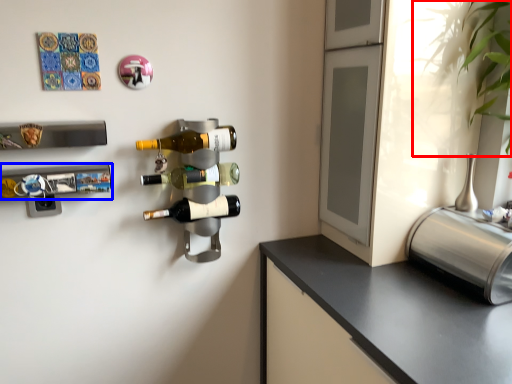
Question: Which object appears farthest to the camera in this image, plant (highlighted by a red box) or wine rack (highlighted by a blue box)?

Choices:
 (A) plant
 (B) wine rack

Answer: (B)